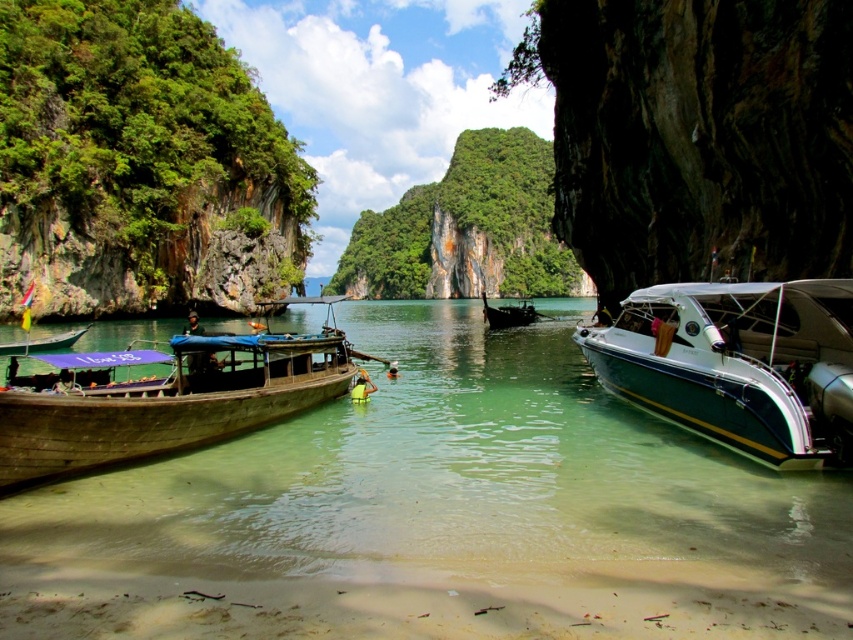
You are standing on the beach looking at the scene. Which object is closer to you, the clear water at center or the green wooden boat at left?

The clear water at center is closer to you than the green wooden boat at left.

You are a swimmer planning to cross from the traditional wooden boat with a canopy on the left to the clear water at center. The boat is 2 meters wide. What is the minimum distance you need to swim?

The minimum distance you need to swim is 14.64 meters minus half the boat width, so 14.64 meters minus 1 meter equals 14.64 meters. Therefore, you need to swim approximately 14.64 meters.

You are a tourist planning to swim from the shore to the wooden boat at left. Given the water depth increases gradually from the shore, can you safely swim to the boat without going into deeper water?

The wooden boat at left is located at point (164, 397), which is close to the shore. Since the water depth increases gradually, you can safely swim to the wooden boat at left without encountering deeper water.